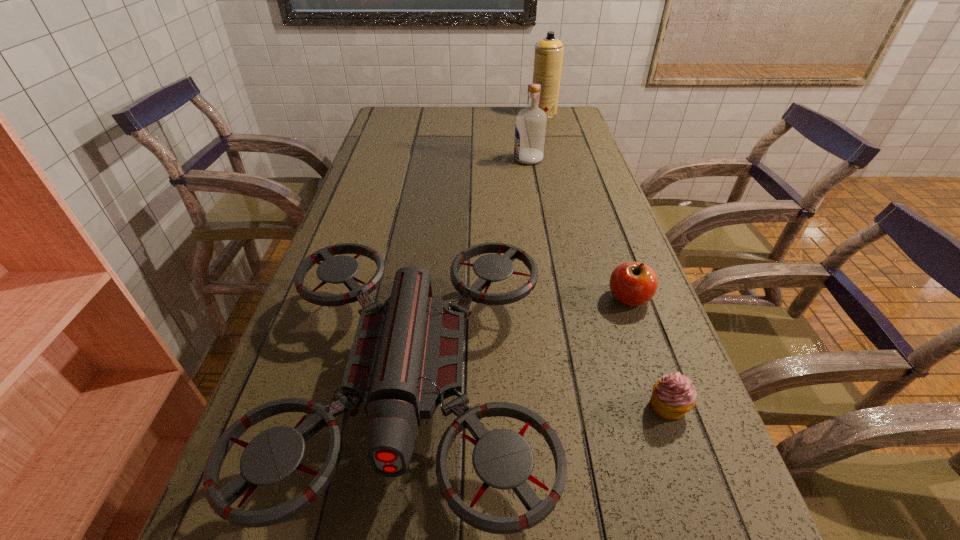
At what (x,y) coordinates should I click in order to perform the action: click on vacant space that's between the tallest object and the cupcake. Please return your answer as a coordinate pair (x, y). The width and height of the screenshot is (960, 540). Looking at the image, I should click on (606, 260).

What are the coordinates of `free space between the farthest object and the apple` in the screenshot? It's located at (586, 206).

Find the location of a particular element. The image size is (960, 540). free space between the vodka and the cupcake is located at coordinates (598, 282).

You are a GUI agent. You are given a task and a screenshot of the screen. Output one action in this format:
    pyautogui.click(x=<x>, y=<y>)
    Task: Click on the free space between the cupcake and the farthest object
    The image size is (960, 540).
    Given the screenshot: What is the action you would take?
    pyautogui.click(x=606, y=260)

Where is `object that ranks as the third closest to the apple`? This screenshot has width=960, height=540. object that ranks as the third closest to the apple is located at coordinates (530, 129).

What are the coordinates of `object identified as the fourth closest to the apple` in the screenshot? It's located at [548, 58].

Find the location of a particular element. This screenshot has width=960, height=540. vacant region that satisfies the following two spatial constraints: 1. on the label of the cupcake; 2. on the left side of the vodka is located at coordinates (571, 406).

Locate an element on the screen. free spot that satisfies the following two spatial constraints: 1. on the label of the vodka; 2. on the right side of the cupcake is located at coordinates (571, 406).

Find the location of a particular element. This screenshot has height=540, width=960. free space that satisfies the following two spatial constraints: 1. on the label of the second farthest object; 2. on the back side of the apple is located at coordinates (552, 298).

The image size is (960, 540). I want to click on blank area in the image that satisfies the following two spatial constraints: 1. on the front side of the apple; 2. on the left side of the tallest object, so pyautogui.click(x=593, y=298).